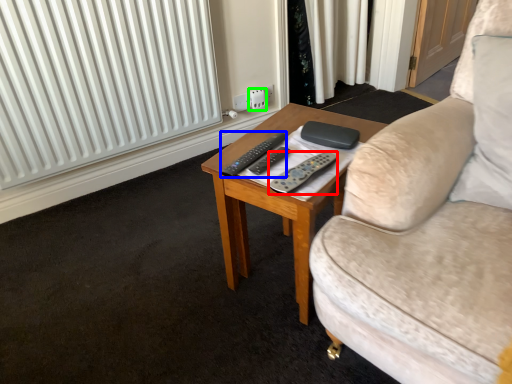
Question: Considering the real-world distances, which object is closest to remote control (highlighted by a red box)? remote control (highlighted by a blue box) or electric outlet (highlighted by a green box).

Choices:
 (A) remote control
 (B) electric outlet

Answer: (A)